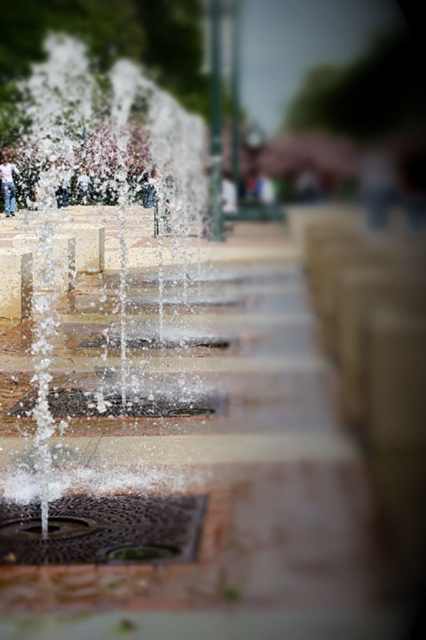
You are standing at the center of the urban plaza and see the point marked at coordinates (109, 333). Based on the scene description, what does this point indicate?

The point at coordinates (109, 333) marks clear water jets at center.

You are standing in the urban plaza and see the clear water jets at center and the light blue jeans at center. Which object is taller?

The clear water jets at center is taller than the light blue jeans at center.